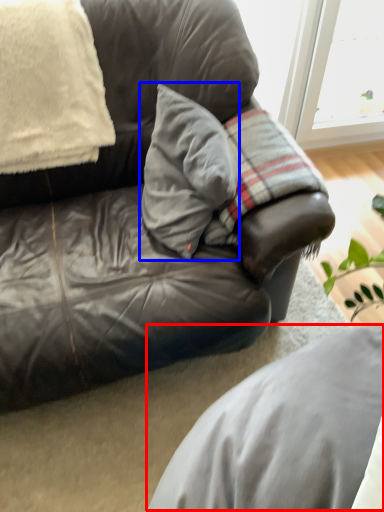
Question: Among these objects, which one is farthest to the camera, gray (highlighted by a red box) or pillow (highlighted by a blue box)?

Choices:
 (A) gray
 (B) pillow

Answer: (B)